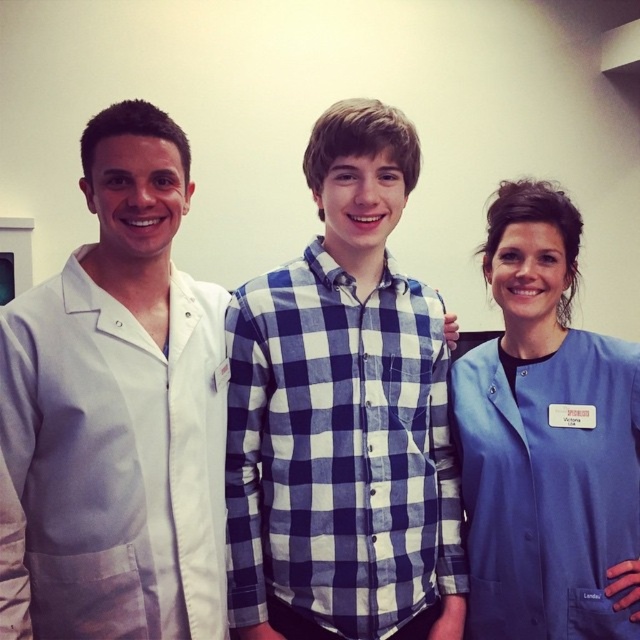
Question: Which object is closer to the camera taking this photo?

Choices:
 (A) blue scrubs at center
 (B) white cotton lab coat at center
 (C) white smooth lab coat at left

Answer: (C)

Question: Can you confirm if white cotton lab coat at center is positioned below blue scrubs at center?

Choices:
 (A) yes
 (B) no

Answer: (A)

Question: Among these objects, which one is nearest to the camera?

Choices:
 (A) white smooth lab coat at left
 (B) white cotton lab coat at center

Answer: (A)

Question: Which point is closer to the camera?

Choices:
 (A) (486, 618)
 (B) (241, 486)

Answer: (B)

Question: Can you confirm if white smooth lab coat at left is positioned above white cotton lab coat at center?

Choices:
 (A) no
 (B) yes

Answer: (B)

Question: In this image, where is white smooth lab coat at left located relative to blue scrubs at center?

Choices:
 (A) right
 (B) left

Answer: (B)